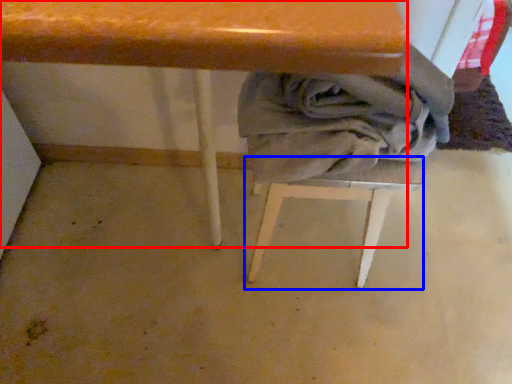
Question: Which point is further to the camera, table (highlighted by a red box) or step stool (highlighted by a blue box)?

Choices:
 (A) table
 (B) step stool

Answer: (B)